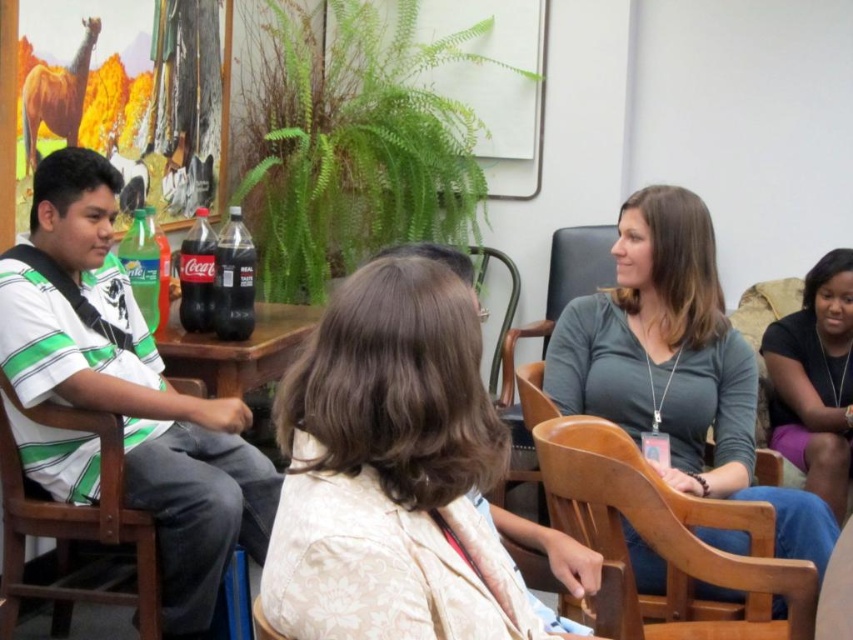
Is white striped shirt at left further to camera compared to wooden chair at center?

Yes, it is.

Does point (177, 563) come behind point (544, 417)?

No, it is in front of (544, 417).

Describe the element at coordinates (131, 387) in the screenshot. I see `white striped shirt at left` at that location.

Find the location of a particular element. white striped shirt at left is located at coordinates (131, 387).

Which of these two, smooth beige blouse at center or gray matte shirt at center, stands taller?

With more height is gray matte shirt at center.

Does smooth beige blouse at center have a greater width compared to gray matte shirt at center?

No.

Where is `smooth beige blouse at center`? smooth beige blouse at center is located at coordinates (392, 472).

Can you confirm if wooden chair at center is positioned below black plastic coca-cola bottle at center?

Correct, wooden chair at center is located below black plastic coca-cola bottle at center.

Which is more to the left, wooden chair at center or black plastic coca-cola bottle at center?

black plastic coca-cola bottle at center is more to the left.

Locate an element on the screen. This screenshot has width=853, height=640. wooden chair at center is located at coordinates (636, 464).